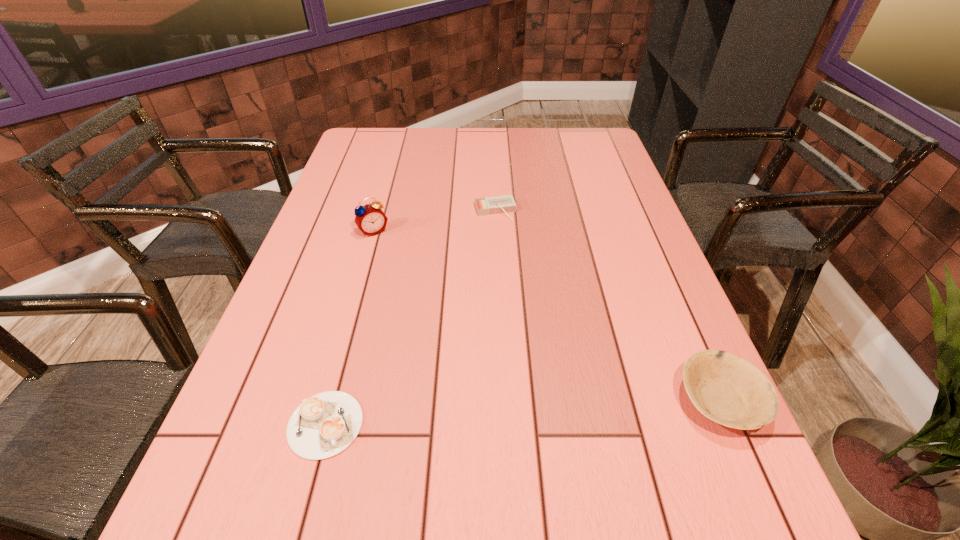
Where is `cappuccino`? cappuccino is located at coordinates (325, 424).

I want to click on the rightmost object, so click(x=726, y=388).

Image resolution: width=960 pixels, height=540 pixels. I want to click on bowl, so pos(726,388).

Locate an element on the screen. This screenshot has height=540, width=960. the tallest object is located at coordinates (370, 219).

The width and height of the screenshot is (960, 540). What are the coordinates of `alarm clock` in the screenshot? It's located at (370, 219).

You are a GUI agent. You are given a task and a screenshot of the screen. Output one action in this format:
    pyautogui.click(x=<x>, y=<y>)
    Task: Click on the second object from right to left
    The width and height of the screenshot is (960, 540).
    Given the screenshot: What is the action you would take?
    pyautogui.click(x=499, y=204)

The image size is (960, 540). Identify the location of the farthest object. (499, 204).

You are a GUI agent. You are given a task and a screenshot of the screen. Output one action in this format:
    pyautogui.click(x=<x>, y=<y>)
    Task: Click on the blank space located on the back of the shortest object
    This screenshot has width=960, height=540.
    Given the screenshot: What is the action you would take?
    pyautogui.click(x=346, y=350)

At what (x,y) coordinates should I click in order to perform the action: click on vacant space located on the left of the rightmost object. Please return your answer as a coordinate pair (x, y). The image size is (960, 540). Looking at the image, I should click on [583, 401].

This screenshot has height=540, width=960. What are the coordinates of `vacant space located 0.370m on the front-facing side of the tallest object` in the screenshot? It's located at (442, 331).